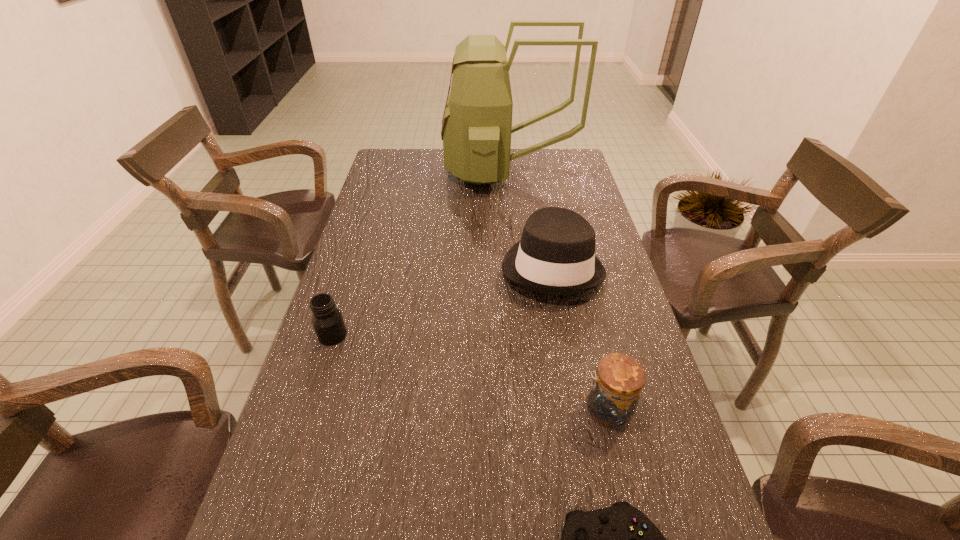
In order to click on backpack in this screenshot , I will do `click(476, 130)`.

The image size is (960, 540). Identify the location of the tallest object. (476, 130).

This screenshot has height=540, width=960. Identify the location of the second farthest object. (556, 254).

Find the location of a particular element. fedora is located at coordinates (556, 254).

At what (x,y) coordinates should I click in order to perform the action: click on the right jar. Please return your answer as a coordinate pair (x, y). The height and width of the screenshot is (540, 960). Looking at the image, I should click on (618, 381).

The image size is (960, 540). What are the coordinates of `the nearer jar` in the screenshot? It's located at (618, 381).

What are the coordinates of `the left jar` in the screenshot? It's located at 327,320.

Find the location of a particular element. The image size is (960, 540). the farther jar is located at coordinates (327, 320).

Image resolution: width=960 pixels, height=540 pixels. In order to click on free space located 0.170m on the front pocket of the tallest object in this screenshot , I will do `click(401, 171)`.

What are the coordinates of `free space located on the front pocket of the tallest object` in the screenshot? It's located at (391, 171).